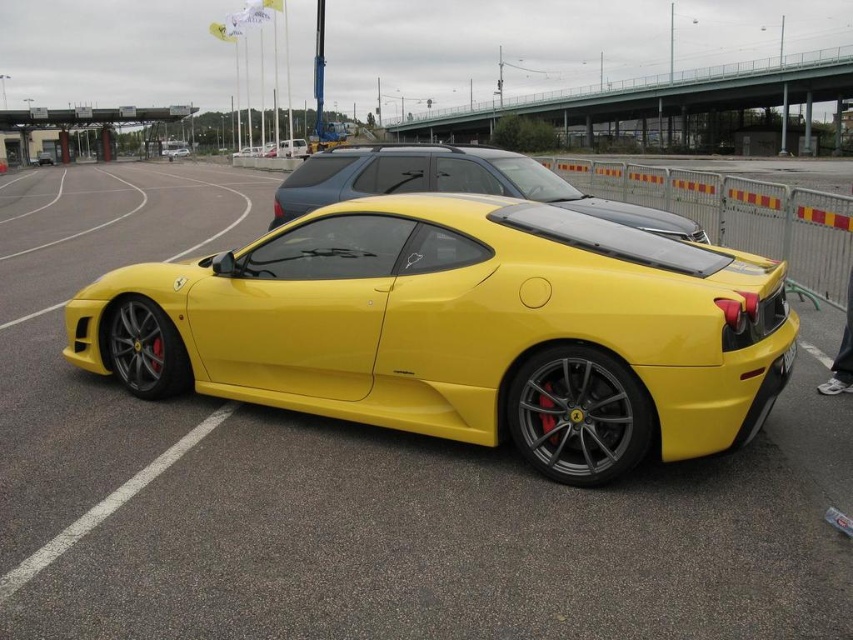
You are standing at the point marked as point (288, 148) in the parking lot. You want to walk to the vibrant yellow Ferrari sports car parked here. Which direction should you head towards?

The vibrant yellow Ferrari sports car is not at point (288, 148). The matte white van at center is located at point (288, 148), so you should head away from that point towards the Ferrari.

You are standing next to the matte white van at center. You want to take a photo of the Ferrari sports car with your camera. The camera has a maximum zoom range of 40 meters. Can you capture the Ferrari sports car in your photo without moving closer?

The matte white van at center and camera are 44.44 meters apart from each other. Since the camera can only zoom up to 40 meters, you cannot capture the Ferrari sports car in your photo without moving closer.